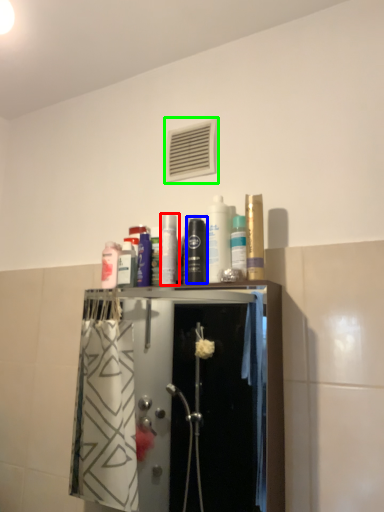
Question: Considering the real-world distances, which object is closest to toiletry (highlighted by a red box)? mouthwash (highlighted by a blue box) or air conditioning (highlighted by a green box).

Choices:
 (A) mouthwash
 (B) air conditioning

Answer: (A)